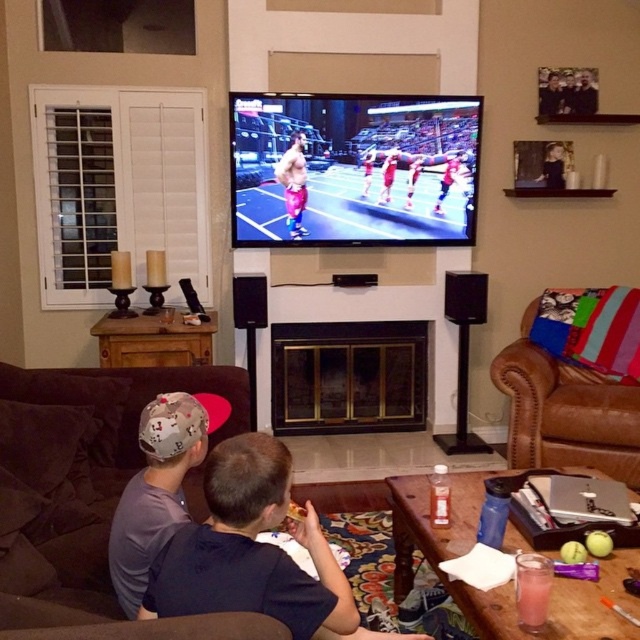
From the picture: You are a parent trying to locate your child who is wearing a gray fabric cap at left and pink fabric shorts at center. Based on the scene description, where would you find the child in relation to the TV and couch?

The gray fabric cap at left is below the pink fabric shorts at center, indicating the child is sitting on the couch facing the TV, with the cap positioned lower than the shorts. Since the couch is where the children are seated watching the TV, the child is likely seated on the couch near the left side, with the cap positioned below the shorts as described.

You are a parent trying to place a gray fabric cap at left on the brown leather couch at right. Can you place it without worrying about it falling off?

The brown leather couch at right is much taller than the gray fabric cap at left, so placing the gray fabric cap at left on it may cause it to fall off due to the height difference.